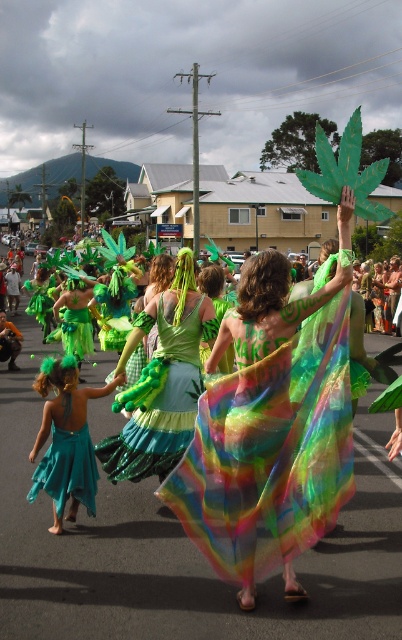
You are a photographer trying to capture the vibrant colors of the parade. You notice the rainbow sheer fabric at center and the teal chiffon dress at lower left. Which object should you focus on to ensure the background is blurred while keeping the subject sharp?

The rainbow sheer fabric at center is above the teal chiffon dress at lower left, so focusing on the rainbow sheer fabric at center will keep it sharp while the background including the teal chiffon dress at lower left may blur due to its lower position.

You are a photographer at the parade and want to capture both the green satin dress at center and the teal chiffon dress at lower left in a single frame. Which dress should you focus on to ensure both are in the frame without zooming in too much?

The green satin dress at center is bigger than the teal chiffon dress at lower left, so focusing on the larger green satin dress at center will help keep both dresses in the frame without excessive zooming.

In the parade scene, you notice two participants wearing the green satin dress at center and the teal chiffon dress at lower left. Which participant is wearing the taller dress?

The green satin dress at center has a greater height compared to the teal chiffon dress at lower left, so the participant wearing the green satin dress at center has the taller dress.